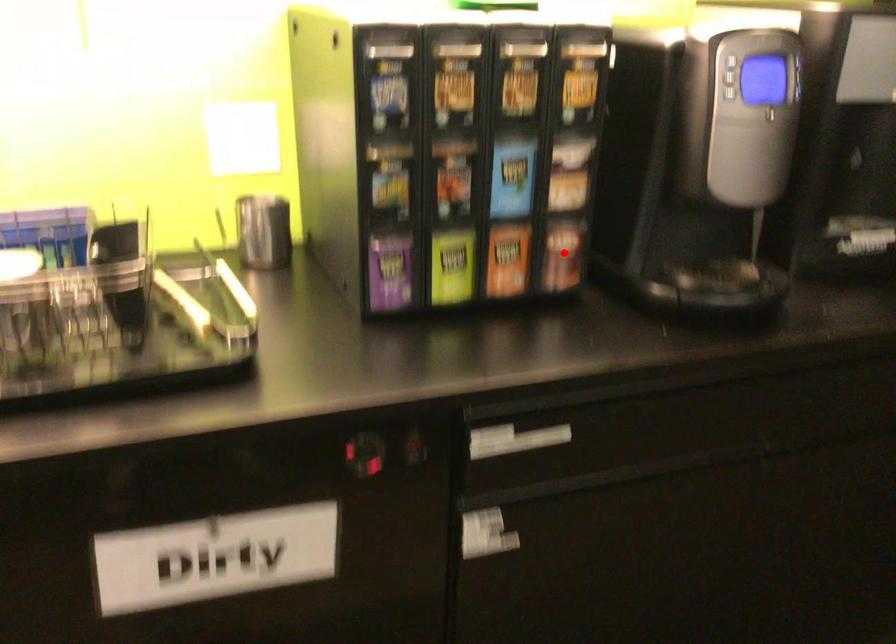
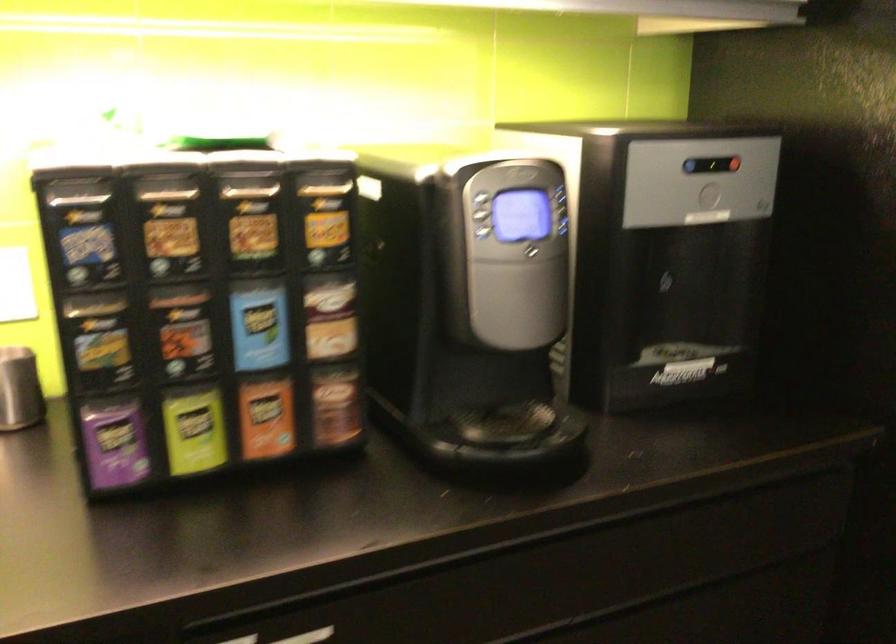
Where in the second image is the point corresponding to the highlighted location from the first image?

(336, 406)